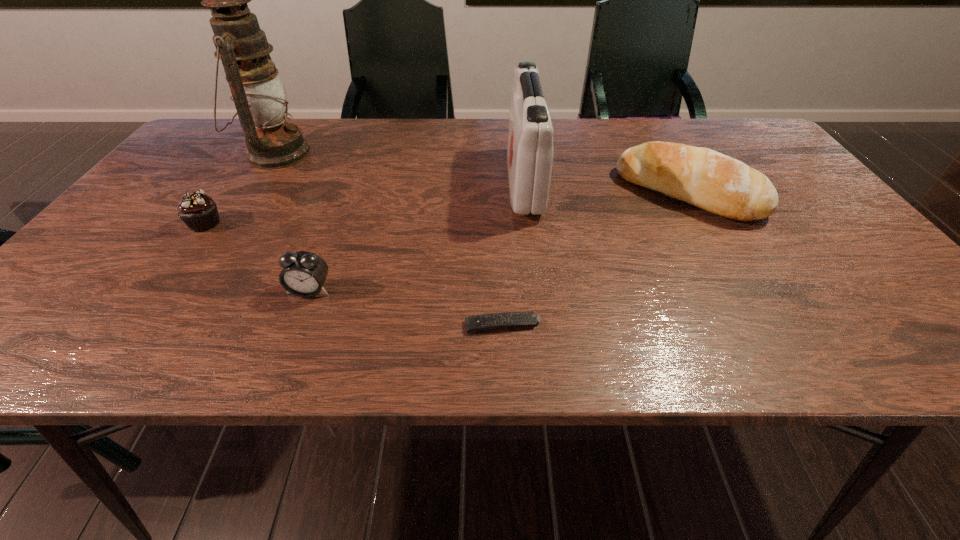
The image size is (960, 540). Identify the location of object that stands as the third closest to the tallest object. (530, 151).

Locate an element on the screen. This screenshot has height=540, width=960. free space that satisfies the following two spatial constraints: 1. on the back side of the bread; 2. on the front side of the first-aid kit is located at coordinates (682, 183).

Find the location of `free location that satisfies the following two spatial constraints: 1. on the front side of the third object from left to right; 2. on the left side of the nearest object`. free location that satisfies the following two spatial constraints: 1. on the front side of the third object from left to right; 2. on the left side of the nearest object is located at coordinates (297, 325).

Locate an element on the screen. This screenshot has width=960, height=540. free space that satisfies the following two spatial constraints: 1. on the front side of the bread; 2. on the right side of the second tallest object is located at coordinates (526, 193).

Where is `free space that satisfies the following two spatial constraints: 1. on the front side of the second tallest object; 2. on the right side of the bread`? The image size is (960, 540). free space that satisfies the following two spatial constraints: 1. on the front side of the second tallest object; 2. on the right side of the bread is located at coordinates (526, 193).

The height and width of the screenshot is (540, 960). In order to click on free location that satisfies the following two spatial constraints: 1. on the front side of the second tallest object; 2. on the front side of the cupcake in this screenshot , I will do `click(530, 224)`.